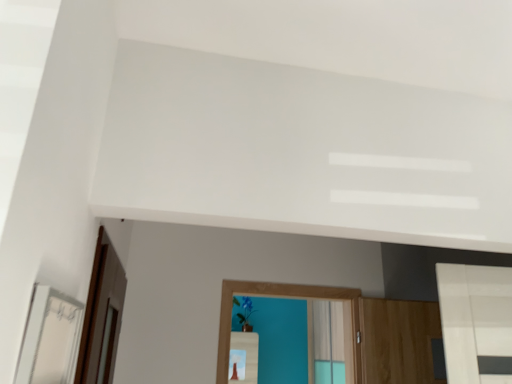
Question: Is white glossy mirror at left oriented away from brown wooden screen door at left?

Choices:
 (A) no
 (B) yes

Answer: (A)

Question: Is white glossy mirror at left with brown wooden screen door at left?

Choices:
 (A) yes
 (B) no

Answer: (B)

Question: Does white glossy mirror at left lie behind brown wooden screen door at left?

Choices:
 (A) no
 (B) yes

Answer: (A)

Question: Does white glossy mirror at left have a lesser width compared to brown wooden screen door at left?

Choices:
 (A) yes
 (B) no

Answer: (A)

Question: Is white glossy mirror at left positioned far away from brown wooden screen door at left?

Choices:
 (A) no
 (B) yes

Answer: (A)

Question: Considering the relative sizes of white glossy mirror at left and brown wooden screen door at left in the image provided, is white glossy mirror at left taller than brown wooden screen door at left?

Choices:
 (A) no
 (B) yes

Answer: (A)

Question: Is brown wooden screen door at left turned away from white glossy mirror at left?

Choices:
 (A) yes
 (B) no

Answer: (B)

Question: Is brown wooden screen door at left with white glossy mirror at left?

Choices:
 (A) yes
 (B) no

Answer: (B)

Question: Does brown wooden screen door at left have a smaller size compared to white glossy mirror at left?

Choices:
 (A) yes
 (B) no

Answer: (B)

Question: Is brown wooden screen door at left completely or partially outside of white glossy mirror at left?

Choices:
 (A) yes
 (B) no

Answer: (A)

Question: Is brown wooden screen door at left shorter than white glossy mirror at left?

Choices:
 (A) yes
 (B) no

Answer: (B)

Question: Is white glossy mirror at left inside brown wooden screen door at left?

Choices:
 (A) yes
 (B) no

Answer: (B)

Question: Is point (32, 349) positioned closer to the camera than point (110, 273)?

Choices:
 (A) farther
 (B) closer

Answer: (B)